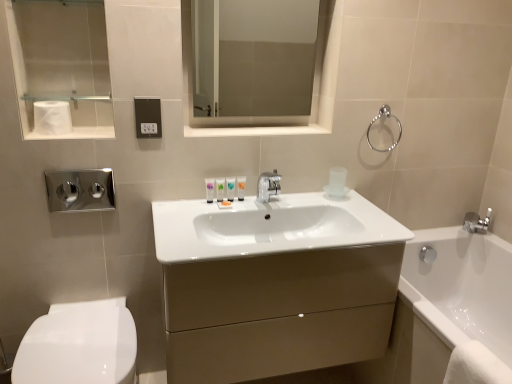
You are a GUI agent. You are given a task and a screenshot of the screen. Output one action in this format:
    pyautogui.click(x=<x>, y=<y>)
    Task: Click on the free space in front of matte purple tube at center, placed as the 1th toiletry when sorted from left to right
    The image size is (512, 384).
    Given the screenshot: What is the action you would take?
    pyautogui.click(x=189, y=216)